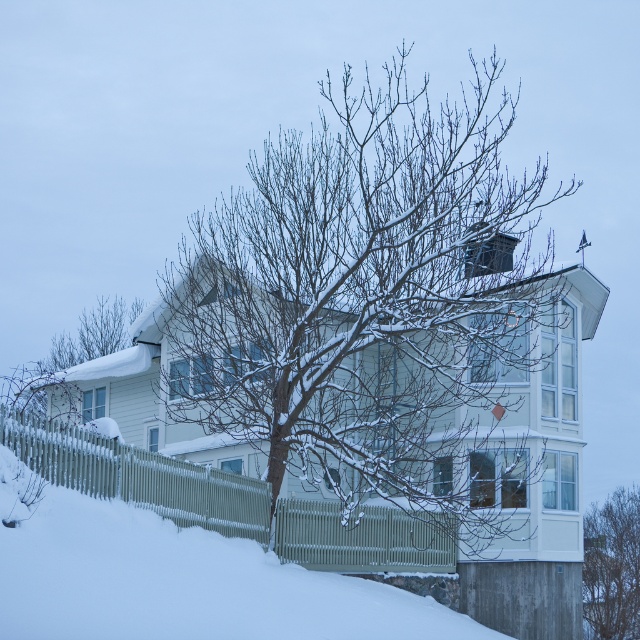
Question: Does snow-covered bare tree at center lie behind bare branches at lower right?

Choices:
 (A) no
 (B) yes

Answer: (A)

Question: Which is farther from the bare branches at lower right?

Choices:
 (A) snow-covered branches at left
 (B) snow-covered bare tree at center

Answer: (A)

Question: Which of the following is the closest to the observer?

Choices:
 (A) (452, 164)
 (B) (609, 538)
 (C) (13, 404)

Answer: (A)

Question: Does snow-covered bare tree at center appear on the right side of green painted wood fence at lower left?

Choices:
 (A) no
 (B) yes

Answer: (B)

Question: Does green painted wood fence at lower left have a greater width compared to snow-covered branches at left?

Choices:
 (A) no
 (B) yes

Answer: (A)

Question: Which point is closer to the camera taking this photo?

Choices:
 (A) (56, 346)
 (B) (45, 468)
 (C) (611, 608)
 (D) (282, 161)

Answer: (B)